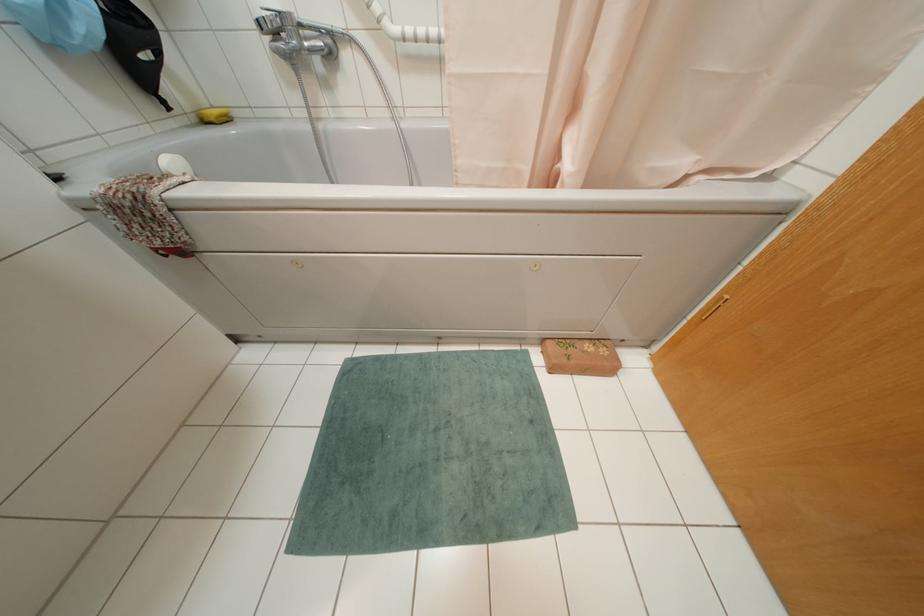
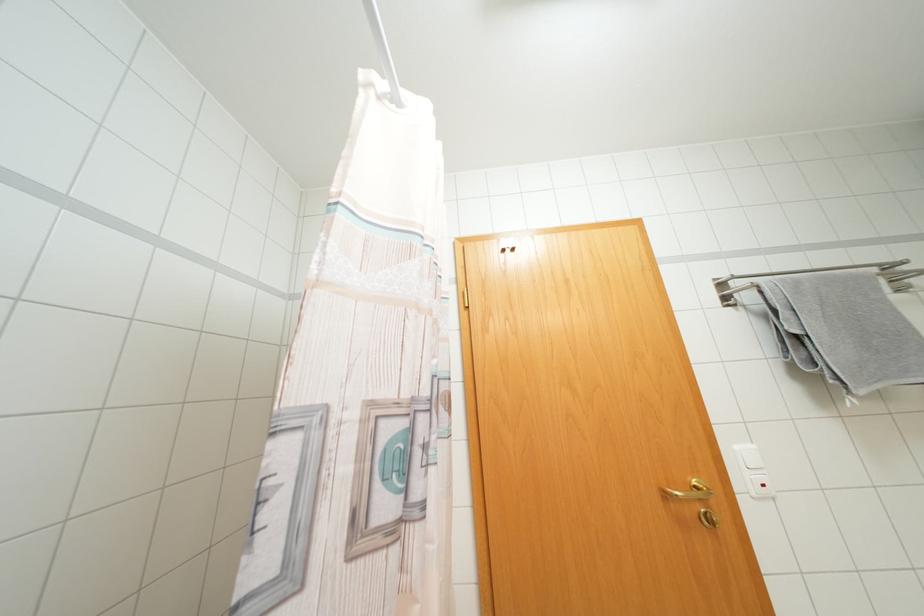
Question: The first image is from the beginning of the video and the second image is from the end. How did the camera likely rotate when shooting the video?

Choices:
 (A) Left
 (B) Right
 (C) Up
 (D) Down

Answer: (B)